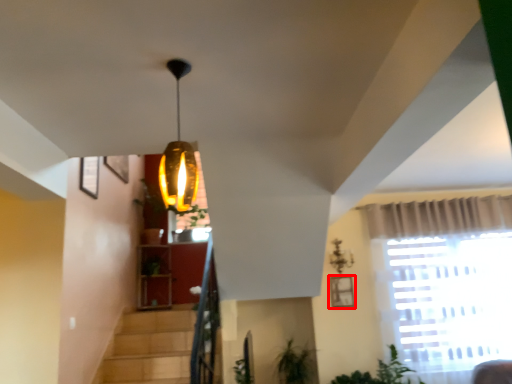
Question: From the image's perspective, what is the correct spatial positioning of picture frame (annotated by the red box) in reference to lamp?

Choices:
 (A) below
 (B) above

Answer: (A)